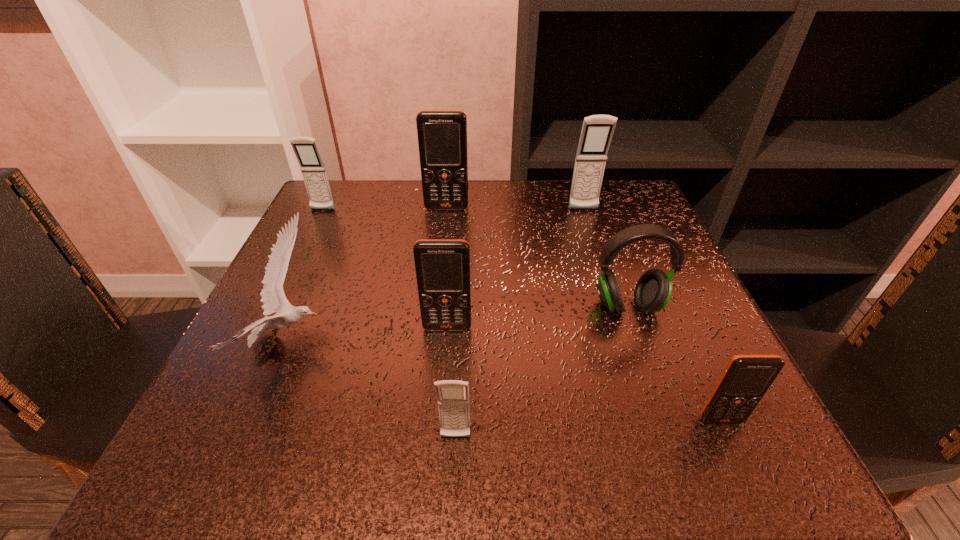
Where is `free location that satisfies the following two spatial constraints: 1. on the screen of the farthest orange cellular telephone; 2. at the tip of the beak of the gull`? The width and height of the screenshot is (960, 540). free location that satisfies the following two spatial constraints: 1. on the screen of the farthest orange cellular telephone; 2. at the tip of the beak of the gull is located at coordinates (433, 341).